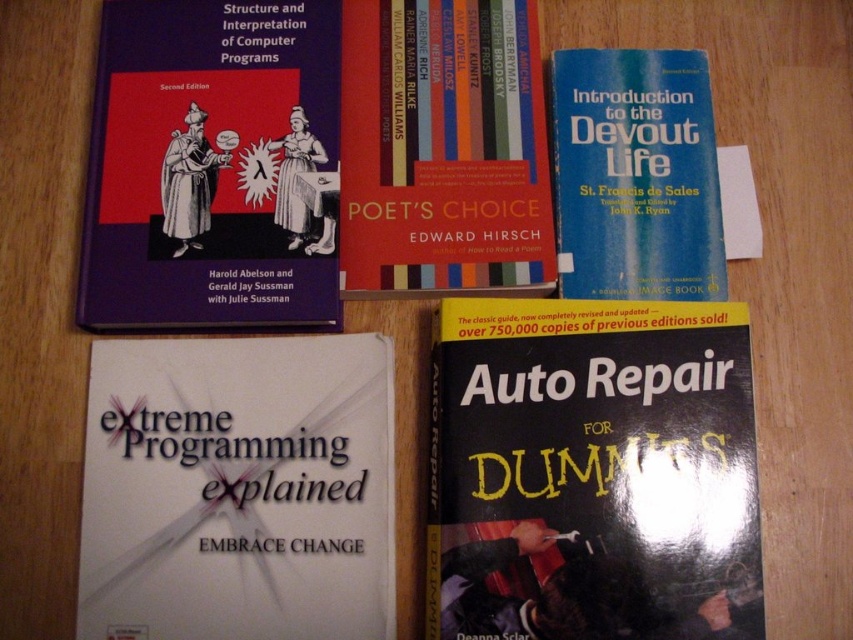
You are organizing a bookshelf and need to stack the white paper at lower left and the blue hardcover book at upper right vertically. Which one should you place at the bottom to ensure stability?

To ensure stability when stacking, place the white paper at lower left at the bottom since it has a greater height than the blue hardcover book at upper right, providing a more stable base.

You are standing at the camera position and want to reach the red matte book at upper center. Can you grab it without moving your hand more than 30 inches?

The red matte book at upper center and camera are 33.42 inches apart, so you cannot grab it without moving your hand more than 30 inches.

You are organizing a library shelf and need to place the red matte book at upper center and the blue hardcover book at upper right. The shelf has a space of 12 centimeters between two other books. Is there enough space to fit both books side by side without overlapping?

The distance between the red matte book at upper center and the blue hardcover book at upper right is 10.37 centimeters, which is less than the 12 centimeter space available. Therefore, there is enough space to fit both books side by side without overlapping.